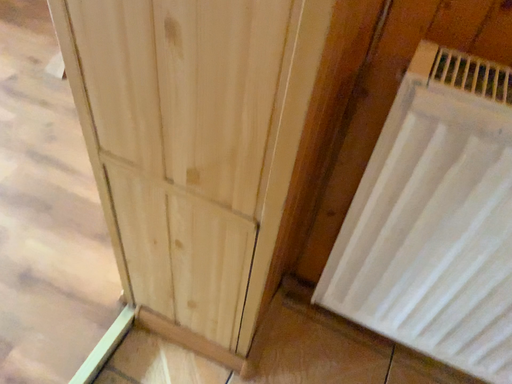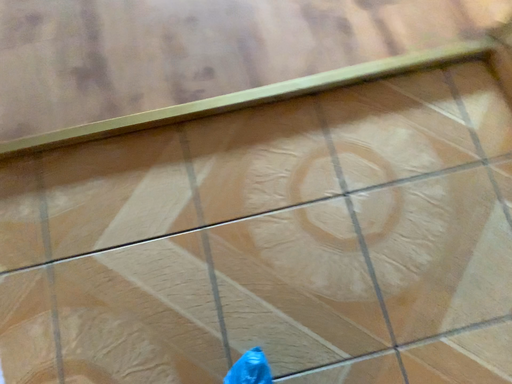
Question: Which way did the camera rotate in the video?

Choices:
 (A) rotated right
 (B) rotated left

Answer: (B)